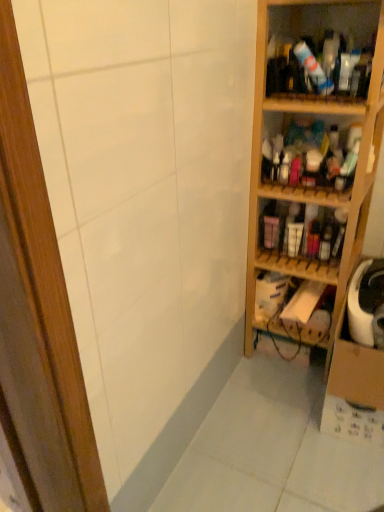
Question: Is wooden shelf at right, marked as the fifth shelf in a top-to-bottom arrangement, to the right of wooden shelves at right, which appears as the second shelf when viewed from the top, from the viewer's perspective?

Choices:
 (A) yes
 (B) no

Answer: (A)

Question: From the image's perspective, is wooden shelf at right, marked as the fifth shelf in a top-to-bottom arrangement, under wooden shelves at right, which appears as the second shelf when viewed from the top?

Choices:
 (A) no
 (B) yes

Answer: (B)

Question: Does wooden shelf at right, which is counted as the 1th shelf, starting from the bottom, have a larger size compared to wooden shelves at right, the 4th shelf in the bottom-to-top sequence?

Choices:
 (A) no
 (B) yes

Answer: (A)

Question: From the image's perspective, is wooden shelf at right, which is counted as the 1th shelf, starting from the bottom, located above wooden shelves at right, which appears as the second shelf when viewed from the top?

Choices:
 (A) no
 (B) yes

Answer: (A)

Question: Is wooden shelf at right, which is counted as the 1th shelf, starting from the bottom, turned away from wooden shelves at right, which appears as the second shelf when viewed from the top?

Choices:
 (A) yes
 (B) no

Answer: (B)

Question: From a real-world perspective, does wooden shelf at right, which is counted as the 1th shelf, starting from the bottom, sit lower than wooden shelves at right, the 4th shelf in the bottom-to-top sequence?

Choices:
 (A) yes
 (B) no

Answer: (A)

Question: From a real-world perspective, is translucent plastic bottles at upper right, arranged as the 1th shelf when viewed from the top, physically below matte plastic bottles at center right, the 2th shelf in the bottom-to-top sequence?

Choices:
 (A) no
 (B) yes

Answer: (A)

Question: From the image's perspective, is translucent plastic bottles at upper right, arranged as the 1th shelf when viewed from the top, below matte plastic bottles at center right, which appears as the fourth shelf when viewed from the top?

Choices:
 (A) no
 (B) yes

Answer: (A)

Question: Can you confirm if translucent plastic bottles at upper right, arranged as the 1th shelf when viewed from the top, is bigger than matte plastic bottles at center right, which appears as the fourth shelf when viewed from the top?

Choices:
 (A) yes
 (B) no

Answer: (A)

Question: Considering the relative sizes of translucent plastic bottles at upper right, arranged as the 1th shelf when viewed from the top, and matte plastic bottles at center right, the 2th shelf in the bottom-to-top sequence, in the image provided, is translucent plastic bottles at upper right, arranged as the 1th shelf when viewed from the top, shorter than matte plastic bottles at center right, the 2th shelf in the bottom-to-top sequence,?

Choices:
 (A) no
 (B) yes

Answer: (A)

Question: Are translucent plastic bottles at upper right, arranged as the 1th shelf when viewed from the top, and matte plastic bottles at center right, which appears as the fourth shelf when viewed from the top, located far from each other?

Choices:
 (A) yes
 (B) no

Answer: (B)

Question: Considering the relative sizes of translucent plastic bottles at upper right, arranged as the 1th shelf when viewed from the top, and matte plastic bottles at center right, which appears as the fourth shelf when viewed from the top, in the image provided, is translucent plastic bottles at upper right, arranged as the 1th shelf when viewed from the top, smaller than matte plastic bottles at center right, which appears as the fourth shelf when viewed from the top,?

Choices:
 (A) yes
 (B) no

Answer: (B)

Question: From the image's perspective, would you say wooden shelf at right, positioned as the third shelf in bottom-to-top order, is shown under translucent plastic bottles at upper right, which is counted as the fifth shelf, starting from the bottom?

Choices:
 (A) no
 (B) yes

Answer: (B)